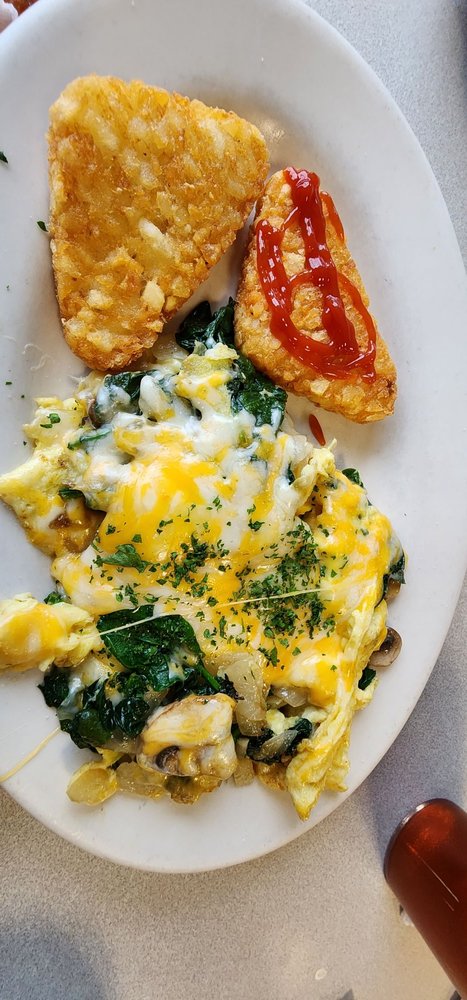
Identify the location of cup. (448, 936), (421, 813).